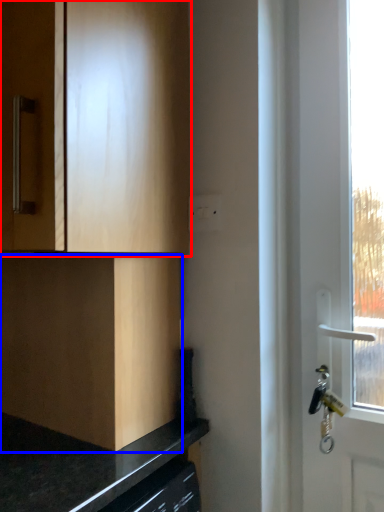
Question: Which of the following is the farthest to the observer, cabinetry (highlighted by a red box) or cabinetry (highlighted by a blue box)?

Choices:
 (A) cabinetry
 (B) cabinetry

Answer: (B)